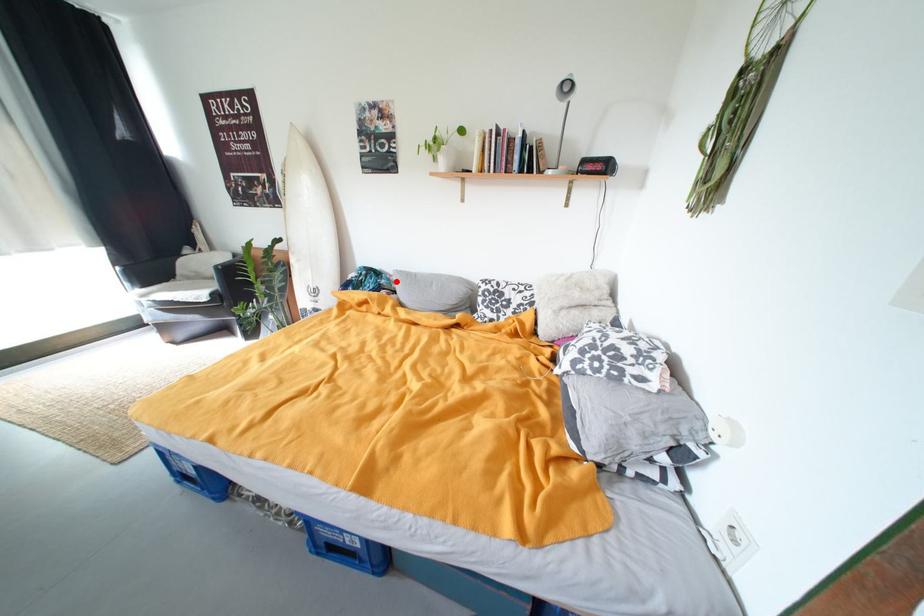
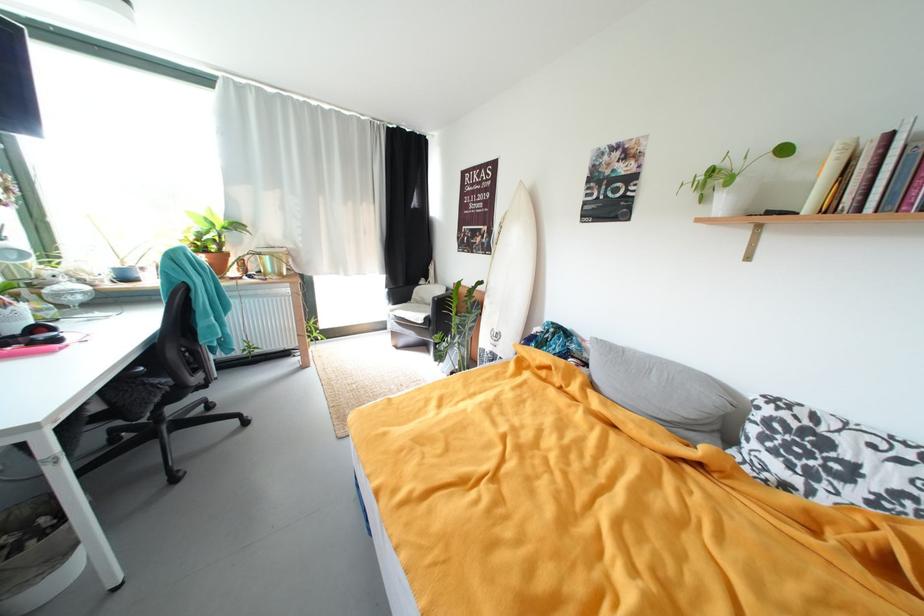
In the second image, find the point that corresponds to the highlighted location in the first image.

(588, 347)